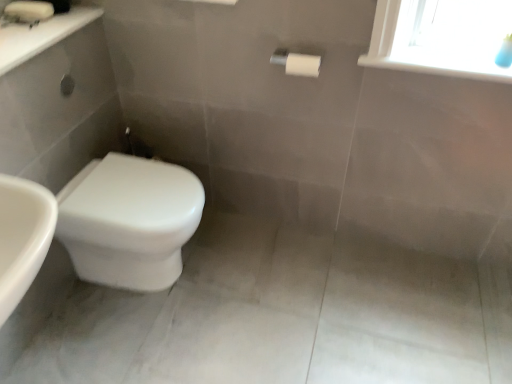
Where is `vacant area that lies to the right of white glossy toilet at lower left`? Image resolution: width=512 pixels, height=384 pixels. vacant area that lies to the right of white glossy toilet at lower left is located at coordinates (250, 274).